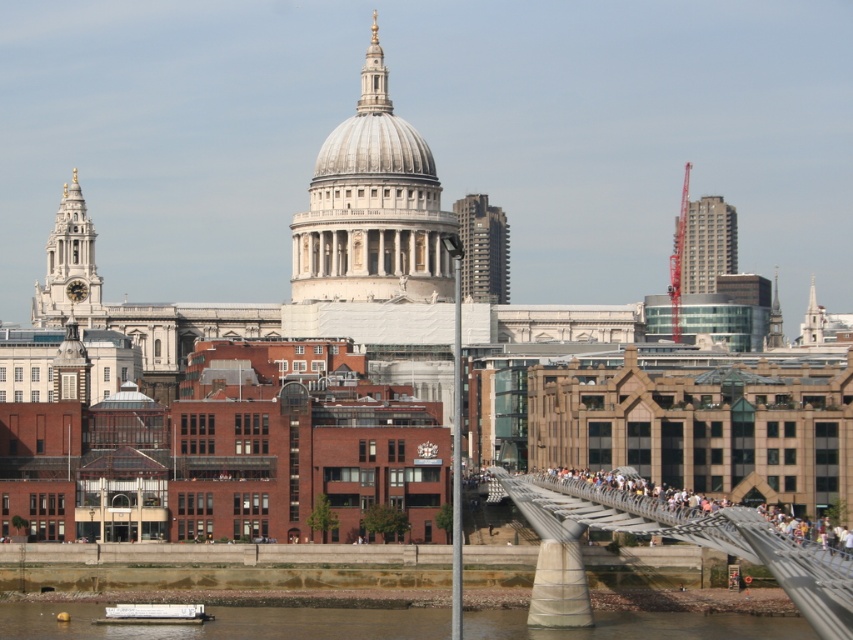
Question: Considering the real-world distances, which object is farthest from the white matte barge at lower center?

Choices:
 (A) metallic gray bridge at lower right
 (B) brown stone river at lower center

Answer: (A)

Question: Among these points, which one is farthest from the camera?

Choices:
 (A) (532, 515)
 (B) (665, 624)

Answer: (B)

Question: Is metallic gray bridge at lower right positioned behind white matte barge at lower center?

Choices:
 (A) yes
 (B) no

Answer: (B)

Question: Does brown stone river at lower center have a larger size compared to white matte barge at lower center?

Choices:
 (A) yes
 (B) no

Answer: (A)

Question: Which point is closer to the camera taking this photo?

Choices:
 (A) (708, 541)
 (B) (544, 637)

Answer: (A)

Question: Does metallic gray bridge at lower right have a smaller size compared to white matte barge at lower center?

Choices:
 (A) no
 (B) yes

Answer: (A)